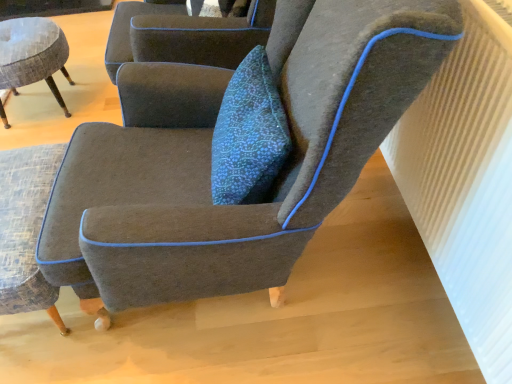
Locate an element on the screen. Image resolution: width=512 pixels, height=384 pixels. dark gray fabric chair at center, the 3th chair when ordered from left to right is located at coordinates (210, 159).

This screenshot has height=384, width=512. What are the coordinates of `textured gray armchair at lower left, positioned as the second chair in left-to-right order` in the screenshot? It's located at (26, 229).

Between textured gray stool at left, the 1th chair viewed from the left, and white ribbed radiator at upper right, which one has larger size?

With larger size is white ribbed radiator at upper right.

Between textured gray stool at left, the 3th chair when ordered from right to left, and white ribbed radiator at upper right, which one appears on the left side from the viewer's perspective?

Positioned to the left is textured gray stool at left, the 3th chair when ordered from right to left.

Is textured gray stool at left, the 3th chair when ordered from right to left, looking in the opposite direction of white ribbed radiator at upper right?

No, textured gray stool at left, the 3th chair when ordered from right to left, is not facing the opposite direction of white ribbed radiator at upper right.

Is textured gray armchair at lower left, positioned as the second chair in left-to-right order, positioned far away from dark gray fabric chair at center, which is the 1th chair in right-to-left order?

No, textured gray armchair at lower left, positioned as the second chair in left-to-right order, is not far away from dark gray fabric chair at center, which is the 1th chair in right-to-left order.

Which is more to the left, textured gray armchair at lower left, the second chair when ordered from right to left, or dark gray fabric chair at center, which is the 1th chair in right-to-left order?

textured gray armchair at lower left, the second chair when ordered from right to left, is more to the left.

Looking at their sizes, would you say textured gray armchair at lower left, the second chair when ordered from right to left, is wider or thinner than dark gray fabric chair at center, which is the 1th chair in right-to-left order?

Clearly, textured gray armchair at lower left, the second chair when ordered from right to left, has less width compared to dark gray fabric chair at center, which is the 1th chair in right-to-left order.

Which of these two, textured gray armchair at lower left, positioned as the second chair in left-to-right order, or dark gray fabric chair at center, which is the 1th chair in right-to-left order, is smaller?

textured gray armchair at lower left, positioned as the second chair in left-to-right order, is smaller.

Is textured gray stool at left, the 1th chair viewed from the left, far from dark gray fabric chair at center, which is the 1th chair in right-to-left order?

Absolutely, textured gray stool at left, the 1th chair viewed from the left, is distant from dark gray fabric chair at center, which is the 1th chair in right-to-left order.

Is textured gray stool at left, the 1th chair viewed from the left, looking in the opposite direction of dark gray fabric chair at center, which is the 1th chair in right-to-left order?

textured gray stool at left, the 1th chair viewed from the left, is not turned away from dark gray fabric chair at center, which is the 1th chair in right-to-left order.

From a real-world perspective, starting from the dark gray fabric chair at center, the 3th chair when ordered from left to right, which chair is the 1st one below it? Please provide its 2D coordinates.

[(32, 54)]

Would you say dark gray fabric chair at center, which is the 1th chair in right-to-left order, is part of textured gray stool at left, the 1th chair viewed from the left,'s contents?

No, dark gray fabric chair at center, which is the 1th chair in right-to-left order, is not inside textured gray stool at left, the 1th chair viewed from the left.

Is the position of white ribbed radiator at upper right more distant than that of textured gray armchair at lower left, positioned as the second chair in left-to-right order?

No, it is in front of textured gray armchair at lower left, positioned as the second chair in left-to-right order.

Which is correct: white ribbed radiator at upper right is inside textured gray armchair at lower left, the second chair when ordered from right to left, or outside of it?

white ribbed radiator at upper right cannot be found inside textured gray armchair at lower left, the second chair when ordered from right to left.

Who is smaller, white ribbed radiator at upper right or textured gray armchair at lower left, positioned as the second chair in left-to-right order?

textured gray armchair at lower left, positioned as the second chair in left-to-right order, is smaller.

From the image's perspective, is white ribbed radiator at upper right beneath textured gray armchair at lower left, the second chair when ordered from right to left?

Incorrect, from the image's perspective, white ribbed radiator at upper right is higher than textured gray armchair at lower left, the second chair when ordered from right to left.

Can you confirm if dark gray fabric chair at center, which is the 1th chair in right-to-left order, is positioned to the left of textured gray stool at left, the 3th chair when ordered from right to left?

No.

How many degrees apart are the facing directions of dark gray fabric chair at center, the 3th chair when ordered from left to right, and textured gray stool at left, the 3th chair when ordered from right to left?

They differ by 0.00173 degrees in their facing directions.

Is dark gray fabric chair at center, the 3th chair when ordered from left to right, facing away from textured gray stool at left, the 3th chair when ordered from right to left?

No, dark gray fabric chair at center, the 3th chair when ordered from left to right,'s orientation is not away from textured gray stool at left, the 3th chair when ordered from right to left.

From a real-world perspective, between dark gray fabric chair at center, the 3th chair when ordered from left to right, and textured gray stool at left, the 1th chair viewed from the left, who is vertically higher?

dark gray fabric chair at center, the 3th chair when ordered from left to right.

Is white ribbed radiator at upper right outside of textured gray stool at left, the 3th chair when ordered from right to left?

Indeed, white ribbed radiator at upper right is completely outside textured gray stool at left, the 3th chair when ordered from right to left.

From the picture: From the image's perspective, is white ribbed radiator at upper right located beneath textured gray stool at left, the 3th chair when ordered from right to left?

Yes, from the image's perspective, white ribbed radiator at upper right is below textured gray stool at left, the 3th chair when ordered from right to left.

Which of these two, white ribbed radiator at upper right or textured gray stool at left, the 1th chair viewed from the left, is wider?

With larger width is textured gray stool at left, the 1th chair viewed from the left.

Measure the distance from white ribbed radiator at upper right to textured gray stool at left, the 1th chair viewed from the left.

1.71 meters.

Who is shorter, textured gray stool at left, the 3th chair when ordered from right to left, or textured gray armchair at lower left, positioned as the second chair in left-to-right order?

With less height is textured gray armchair at lower left, positioned as the second chair in left-to-right order.

From a real-world perspective, between textured gray stool at left, the 1th chair viewed from the left, and textured gray armchair at lower left, the second chair when ordered from right to left, who is vertically lower?

In real-world perspective, textured gray armchair at lower left, the second chair when ordered from right to left, is lower.

Where is `the 1st chair directly above the textured gray armchair at lower left, the second chair when ordered from right to left (from a real-world perspective)`? This screenshot has width=512, height=384. the 1st chair directly above the textured gray armchair at lower left, the second chair when ordered from right to left (from a real-world perspective) is located at coordinates (32, 54).

There is a textured gray stool at left, the 1th chair viewed from the left. Where is `radiator above it (from a real-world perspective)`? radiator above it (from a real-world perspective) is located at coordinates (466, 179).

At what (x,y) coordinates should I click in order to perform the action: click on chair on the right side of textured gray armchair at lower left, positioned as the second chair in left-to-right order. Please return your answer as a coordinate pair (x, y). Image resolution: width=512 pixels, height=384 pixels. Looking at the image, I should click on (210, 159).

When comparing their distances from textured gray armchair at lower left, positioned as the second chair in left-to-right order, does dark gray fabric chair at center, the 3th chair when ordered from left to right, or textured gray stool at left, the 3th chair when ordered from right to left, seem further?

textured gray stool at left, the 3th chair when ordered from right to left.

When comparing their distances from textured gray armchair at lower left, positioned as the second chair in left-to-right order, does textured gray stool at left, the 1th chair viewed from the left, or white ribbed radiator at upper right seem further?

Based on the image, white ribbed radiator at upper right appears to be further to textured gray armchair at lower left, positioned as the second chair in left-to-right order.

In the scene shown: Which object lies nearer to the anchor point textured gray armchair at lower left, positioned as the second chair in left-to-right order, white ribbed radiator at upper right or textured gray stool at left, the 1th chair viewed from the left?

textured gray stool at left, the 1th chair viewed from the left.

Considering their positions, is textured gray armchair at lower left, the second chair when ordered from right to left, positioned closer to textured gray stool at left, the 1th chair viewed from the left, than white ribbed radiator at upper right?

textured gray armchair at lower left, the second chair when ordered from right to left, is closer to textured gray stool at left, the 1th chair viewed from the left.

Which object lies nearer to the anchor point white ribbed radiator at upper right, dark gray fabric chair at center, which is the 1th chair in right-to-left order, or textured gray armchair at lower left, the second chair when ordered from right to left?

The object closer to white ribbed radiator at upper right is dark gray fabric chair at center, which is the 1th chair in right-to-left order.

From the image, which object appears to be farther from textured gray armchair at lower left, positioned as the second chair in left-to-right order, textured gray stool at left, the 3th chair when ordered from right to left, or dark gray fabric chair at center, which is the 1th chair in right-to-left order?

Among the two, textured gray stool at left, the 3th chair when ordered from right to left, is located further to textured gray armchair at lower left, positioned as the second chair in left-to-right order.

Which object lies nearer to the anchor point dark gray fabric chair at center, the 3th chair when ordered from left to right, textured gray stool at left, the 3th chair when ordered from right to left, or white ribbed radiator at upper right?

white ribbed radiator at upper right lies closer to dark gray fabric chair at center, the 3th chair when ordered from left to right, than the other object.

Based on their spatial positions, is textured gray stool at left, the 1th chair viewed from the left, or dark gray fabric chair at center, the 3th chair when ordered from left to right, further from white ribbed radiator at upper right?

textured gray stool at left, the 1th chair viewed from the left, is positioned further to the anchor white ribbed radiator at upper right.

This screenshot has width=512, height=384. I want to click on chair between textured gray armchair at lower left, positioned as the second chair in left-to-right order, and white ribbed radiator at upper right, in the horizontal direction, so click(210, 159).

Locate an element on the screen. This screenshot has height=384, width=512. chair between dark gray fabric chair at center, which is the 1th chair in right-to-left order, and textured gray stool at left, the 1th chair viewed from the left, from front to back is located at coordinates (26, 229).